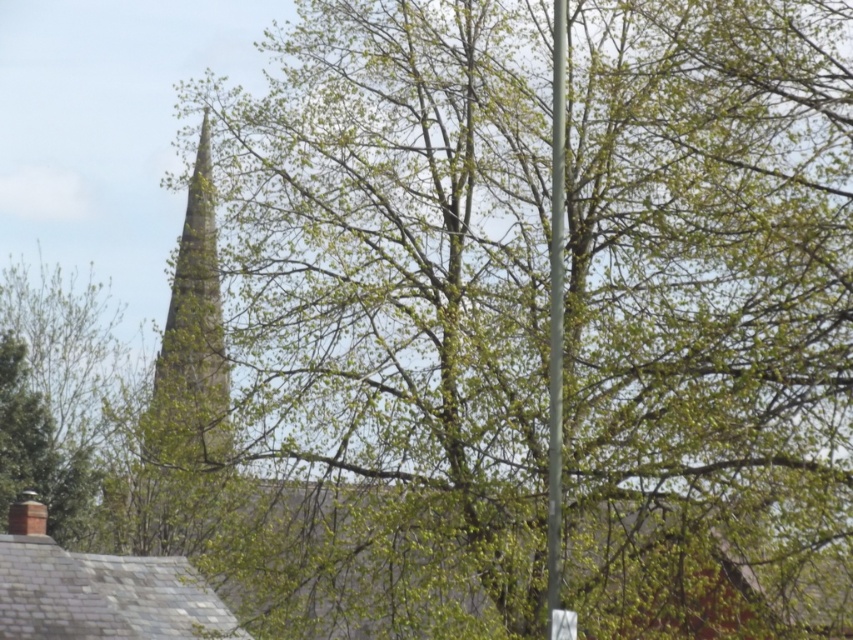
Between smooth gray steeple at center-left and white plastic sign at lower center, which one has less height?

white plastic sign at lower center is shorter.

Between smooth gray steeple at center-left and white plastic sign at lower center, which one appears on the left side from the viewer's perspective?

Positioned to the left is smooth gray steeple at center-left.

Is point (165, 448) positioned before point (561, 609)?

That is False.

The image size is (853, 640). Find the location of `smooth gray steeple at center-left`. smooth gray steeple at center-left is located at coordinates [x=192, y=339].

Is green leafy tree at lower left to the left of smooth gray steeple at center-left from the viewer's perspective?

Yes, green leafy tree at lower left is to the left of smooth gray steeple at center-left.

Locate an element on the screen. The image size is (853, 640). green leafy tree at lower left is located at coordinates (67, 404).

Which is in front, point (85, 397) or point (198, 298)?

Point (198, 298) is more forward.

Locate an element on the screen. This screenshot has width=853, height=640. green leafy tree at lower left is located at coordinates (67, 404).

Is green leafy tree at lower left taller than white plastic sign at lower center?

Yes, green leafy tree at lower left is taller than white plastic sign at lower center.

Does green leafy tree at lower left appear on the right side of white plastic sign at lower center?

Incorrect, green leafy tree at lower left is not on the right side of white plastic sign at lower center.

Where is `green leafy tree at lower left`? green leafy tree at lower left is located at coordinates (67, 404).